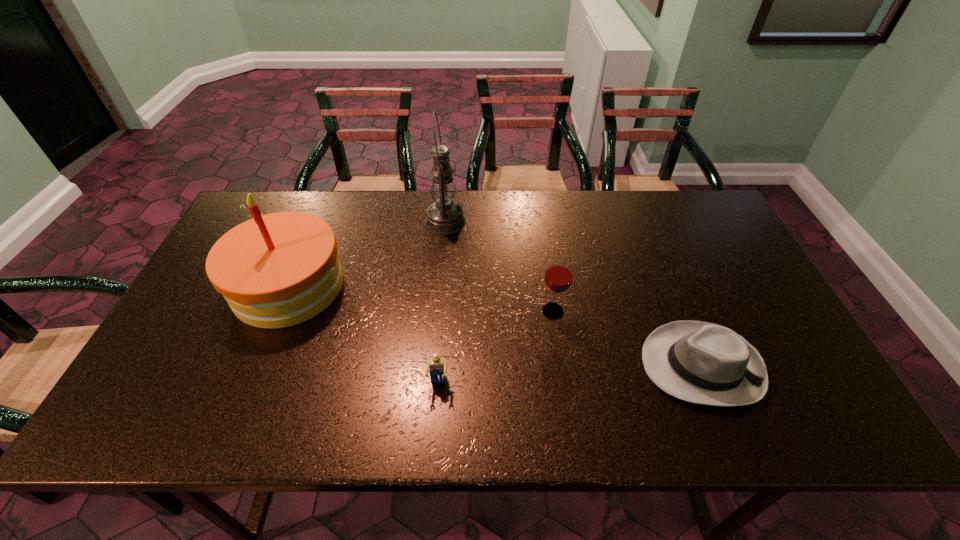
At what (x,y) coordinates should I click in order to perform the action: click on vacant space at the near edge of the desktop. Please return your answer as a coordinate pair (x, y). Looking at the image, I should click on (494, 410).

Where is `vacant area at the left edge`? This screenshot has width=960, height=540. vacant area at the left edge is located at coordinates (199, 315).

I want to click on vacant region at the right edge, so click(x=735, y=313).

This screenshot has height=540, width=960. I want to click on free location at the far left corner, so click(x=262, y=201).

At what (x,y) coordinates should I click in order to perform the action: click on vacant region at the far right corner of the desktop. Please return your answer as a coordinate pair (x, y). The width and height of the screenshot is (960, 540). Looking at the image, I should click on click(x=699, y=231).

Where is `free space between the birthday cake and the second object from right to left`? This screenshot has height=540, width=960. free space between the birthday cake and the second object from right to left is located at coordinates (420, 299).

Where is `vacant region between the third tallest object and the birthday cake`? The width and height of the screenshot is (960, 540). vacant region between the third tallest object and the birthday cake is located at coordinates (420, 299).

The width and height of the screenshot is (960, 540). In order to click on free space between the fourth shortest object and the fedora in this screenshot , I will do `click(495, 326)`.

The height and width of the screenshot is (540, 960). Find the location of `vacant area between the birthday cake and the glass`. vacant area between the birthday cake and the glass is located at coordinates pos(420,299).

Identify the location of vacant space in between the Lego and the oil lamp. Image resolution: width=960 pixels, height=540 pixels. point(442,303).